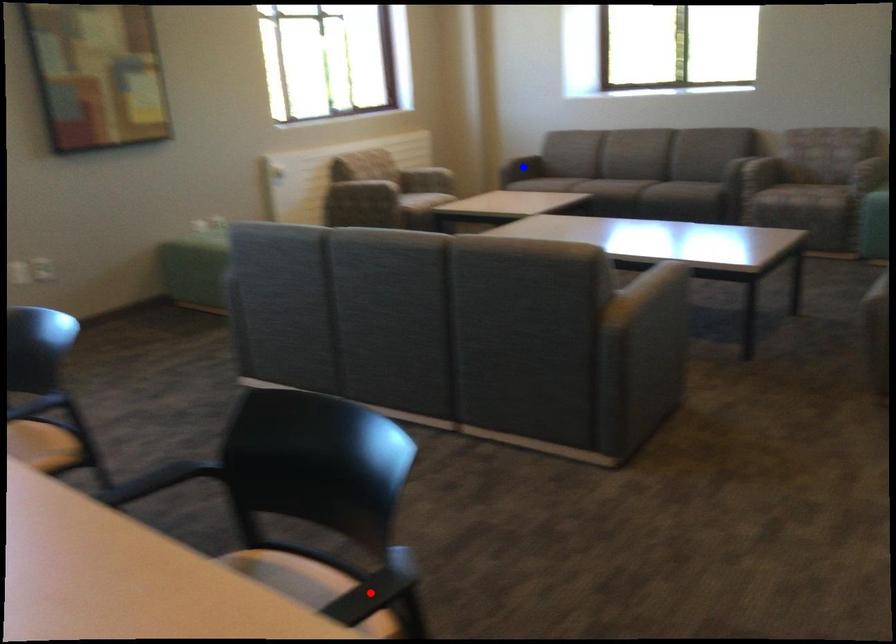
Question: Two points are marked on the image. Which point is closer to the camera?

Choices:
 (A) Blue point is closer.
 (B) Red point is closer.

Answer: (B)